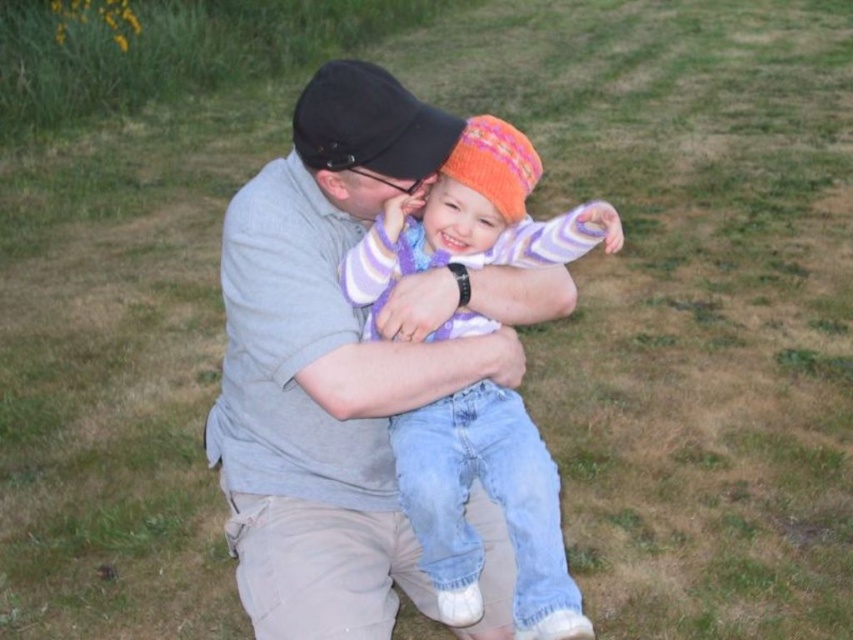
Which object is wider between the knitted woolen hat at center and the black fabric cap at upper center?

The knitted woolen hat at center might be wider than the black fabric cap at upper center according to the description.